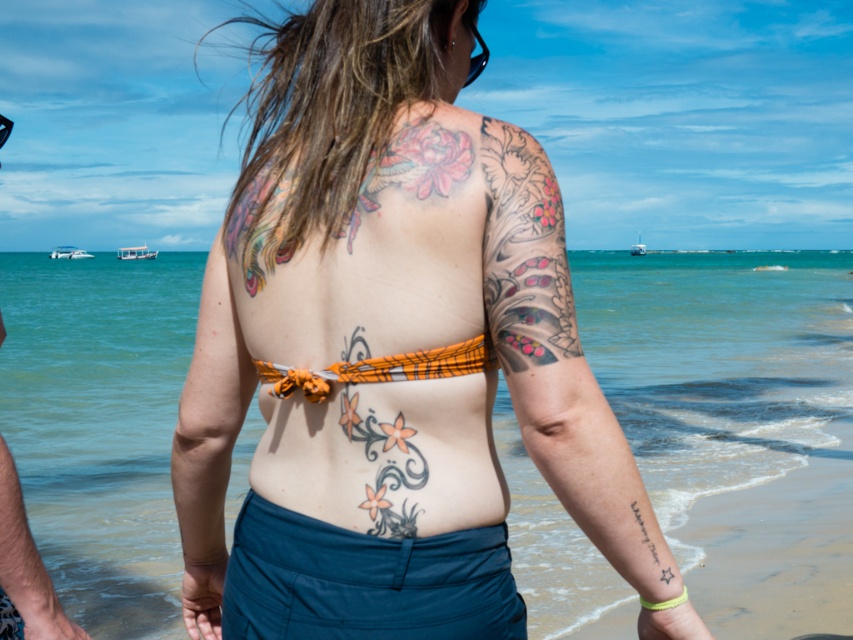
From the picture: Can you confirm if orange fabric bikini top at center is positioned to the right of smooth skin at left?

Indeed, orange fabric bikini top at center is positioned on the right side of smooth skin at left.

Between point (386, 381) and point (16, 484), which one is positioned in front?

Point (386, 381) is in front.

Where is `orange fabric bikini top at center`? orange fabric bikini top at center is located at coordinates (389, 353).

Can you confirm if orange fabric bikini top at center is positioned above black ink star at lower right?

Yes, orange fabric bikini top at center is above black ink star at lower right.

Which is more to the left, orange fabric bikini top at center or black ink star at lower right?

Positioned to the left is orange fabric bikini top at center.

Which is behind, point (292, 220) or point (634, 512)?

The point (292, 220) is behind.

Image resolution: width=853 pixels, height=640 pixels. Find the location of `orange fabric bikini top at center`. orange fabric bikini top at center is located at coordinates (389, 353).

Consider the image. Does clear blue water at center come in front of smooth skin at left?

Yes, it is in front of smooth skin at left.

Between clear blue water at center and smooth skin at left, which one is positioned higher?

clear blue water at center is higher up.

The image size is (853, 640). I want to click on clear blue water at center, so click(99, 426).

The height and width of the screenshot is (640, 853). What are the coordinates of `clear blue water at center` in the screenshot? It's located at (99, 426).